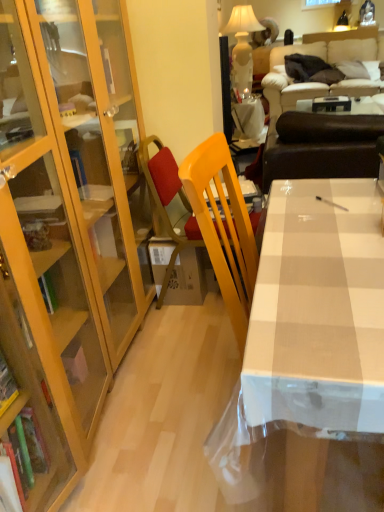
Question: From the image's perspective, would you say white ceramic lamp at upper center is shown under white glossy table at center, the 1th table from the right?

Choices:
 (A) no
 (B) yes

Answer: (A)

Question: Can we say white ceramic lamp at upper center lies outside white glossy table at center, which ranks as the 2th table in left-to-right order?

Choices:
 (A) yes
 (B) no

Answer: (A)

Question: Is white ceramic lamp at upper center shorter than white glossy table at center, which is the second table in back-to-front order?

Choices:
 (A) no
 (B) yes

Answer: (A)

Question: Is white ceramic lamp at upper center bigger than white glossy table at center, the 1th table from the right?

Choices:
 (A) yes
 (B) no

Answer: (A)

Question: Is white ceramic lamp at upper center wider than white glossy table at center, the 1th table from the right?

Choices:
 (A) yes
 (B) no

Answer: (A)

Question: From a real-world perspective, relative to white glossy table at center, the 1th table from the right, is brown leather couch at upper right, acting as the first studio couch starting from the front, vertically above or below?

Choices:
 (A) below
 (B) above

Answer: (B)

Question: Considering the positions of point (281, 140) and point (362, 110), is point (281, 140) closer or farther from the camera than point (362, 110)?

Choices:
 (A) farther
 (B) closer

Answer: (B)

Question: Do you think brown leather couch at upper right, acting as the first studio couch starting from the front, is within white glossy table at center, which ranks as the 2th table in left-to-right order, or outside of it?

Choices:
 (A) outside
 (B) inside

Answer: (A)

Question: Considering the positions of brown leather couch at upper right, the second studio couch viewed from the top, and white glossy table at center, the 1th table from the right, in the image, is brown leather couch at upper right, the second studio couch viewed from the top, taller or shorter than white glossy table at center, the 1th table from the right,?

Choices:
 (A) short
 (B) tall

Answer: (B)

Question: Relative to yellow matte chair at center, is white glossy table at upper center, the second table viewed from the right, in front or behind?

Choices:
 (A) behind
 (B) front

Answer: (A)

Question: From the image's perspective, relative to yellow matte chair at center, is white glossy table at upper center, which is the 1th table from back to front, above or below?

Choices:
 (A) above
 (B) below

Answer: (A)

Question: Looking at their shapes, would you say white glossy table at upper center, which is the 1th table from back to front, is wider or thinner than yellow matte chair at center?

Choices:
 (A) thin
 (B) wide

Answer: (A)

Question: From a real-world perspective, is white glossy table at upper center, the second table in the front-to-back sequence, positioned above or below yellow matte chair at center?

Choices:
 (A) below
 (B) above

Answer: (A)

Question: Is white glossy table at center spatially inside white glossy table at center, which ranks as the 2th table in left-to-right order, or outside of it?

Choices:
 (A) inside
 (B) outside

Answer: (B)

Question: From the image's perspective, relative to white glossy table at center, marked as the 1th table in a front-to-back arrangement, is white glossy table at center above or below?

Choices:
 (A) below
 (B) above

Answer: (A)